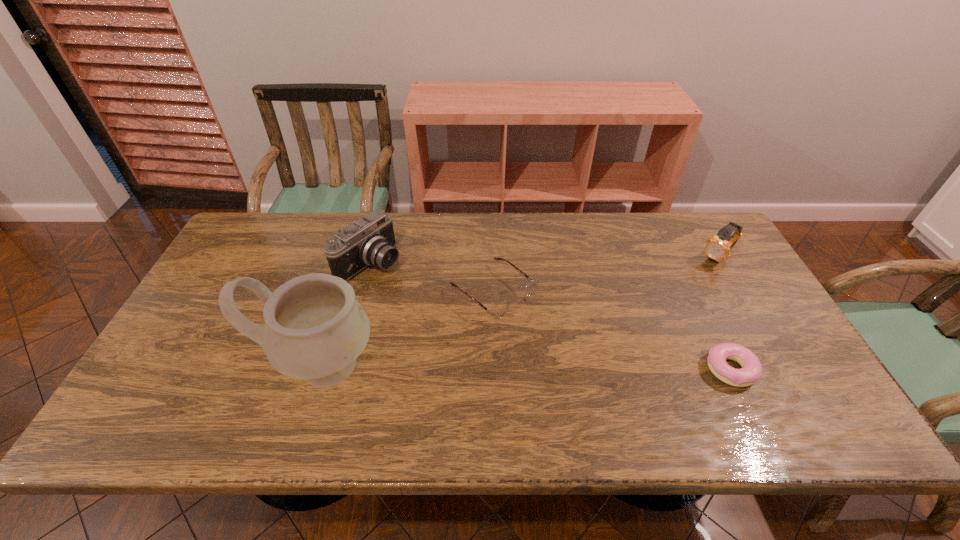
Identify the location of free space on the desktop that is between the pottery and the second object from right to left and is positioned on the face of the third shortest object. The image size is (960, 540). (585, 368).

This screenshot has width=960, height=540. In order to click on free spot on the desktop that is between the tallest object and the second object from right to left and is positioned on the front-facing side of the third object from left to right in this screenshot , I will do `click(585, 368)`.

Find the location of `vacant spot on the desktop that is between the tallest object and the doughnut and is positioned on the front-facing side of the fourth shortest object`. vacant spot on the desktop that is between the tallest object and the doughnut and is positioned on the front-facing side of the fourth shortest object is located at coordinates (552, 368).